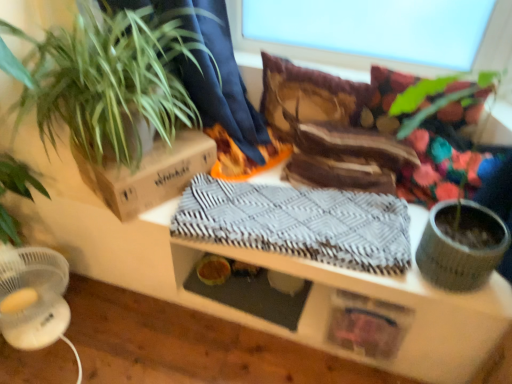
Find the location of `textured wood table at center`. textured wood table at center is located at coordinates (284, 272).

Image resolution: width=512 pixels, height=384 pixels. What do you see at coordinates (298, 223) in the screenshot?
I see `gray woven blanket at center` at bounding box center [298, 223].

The image size is (512, 384). What do you see at coordinates (149, 174) in the screenshot? I see `brown cardboard box at upper left` at bounding box center [149, 174].

Locate an element on the screen. green leafy plant at left is located at coordinates (108, 78).

This screenshot has width=512, height=384. What are the coordinates of `transparent glass window screen at upper center` in the screenshot? It's located at (365, 32).

Looking at this image, from a real-world perspective, is brown cardboard box at upper left physically located above or below textured wood table at center?

From a real-world perspective, brown cardboard box at upper left is physically above textured wood table at center.

Is brown cardboard box at upper left taller than textured wood table at center?

Yes.

Considering the sizes of objects brown cardboard box at upper left and textured wood table at center in the image provided, who is thinner, brown cardboard box at upper left or textured wood table at center?

With smaller width is brown cardboard box at upper left.

Is the position of brown cardboard box at upper left less distant than that of textured wood table at center?

No, it is not.

Does point (300, 235) appear closer or farther from the camera than point (150, 202)?

Point (300, 235) appears to be closer to the viewer than point (150, 202).

Considering the sizes of objects gray woven blanket at center and brown cardboard box at upper left in the image provided, who is bigger, gray woven blanket at center or brown cardboard box at upper left?

gray woven blanket at center.

From the image's perspective, which one is positioned higher, gray woven blanket at center or brown cardboard box at upper left?

From the image's view, brown cardboard box at upper left is above.

Considering the positions of objects gray woven blanket at center and brown cardboard box at upper left in the image provided, who is behind, gray woven blanket at center or brown cardboard box at upper left?

brown cardboard box at upper left is further away from the camera.

Which is more to the left, gray woven blanket at center or transparent glass window screen at upper center?

gray woven blanket at center is more to the left.

From the picture: Considering their positions, is gray woven blanket at center located in front of or behind transparent glass window screen at upper center?

In the image, gray woven blanket at center appears in front of transparent glass window screen at upper center.

Looking at their sizes, would you say gray woven blanket at center is wider or thinner than transparent glass window screen at upper center?

Considering their sizes, gray woven blanket at center looks broader than transparent glass window screen at upper center.

In order to click on table lying above the gray woven blanket at center (from the image's perspective) in this screenshot , I will do `click(284, 272)`.

Is gray woven blanket at center completely or partially inside textured wood table at center?

Yes, gray woven blanket at center can be found within textured wood table at center.

Which object is further away from the camera taking this photo, textured wood table at center or gray woven blanket at center?

gray woven blanket at center is further from the camera.

From a real-world perspective, which is physically above, textured wood table at center or gray woven blanket at center?

From a 3D spatial view, gray woven blanket at center is above.

Which of these two, green leafy plant at left or brown cardboard box at upper left, stands shorter?

Standing shorter between the two is brown cardboard box at upper left.

Which object is wider, green leafy plant at left or brown cardboard box at upper left?

→ Wider between the two is green leafy plant at left.

Is green leafy plant at left to the left of brown cardboard box at upper left from the viewer's perspective?

Yes.

Considering the positions of points (263, 3) and (129, 178), is point (263, 3) farther from camera compared to point (129, 178)?

Yes, point (263, 3) is farther from viewer.

Is transparent glass window screen at upper center spatially inside brown cardboard box at upper left, or outside of it?

transparent glass window screen at upper center is not inside brown cardboard box at upper left, it's outside.

You are a GUI agent. You are given a task and a screenshot of the screen. Output one action in this format:
    pyautogui.click(x=<x>, y=<y>)
    Task: Click on the cardboard box directly beneath the transparent glass window screen at upper center (from a real-world perspective)
    Image resolution: width=512 pixels, height=384 pixels.
    Given the screenshot: What is the action you would take?
    pyautogui.click(x=149, y=174)

Is the surface of transparent glass window screen at upper center in direct contact with brown cardboard box at upper left?

No.

Can you confirm if green leafy plant at left is thinner than velvet brown pillow at center?

No.

From the image's perspective, is green leafy plant at left on velvet brown pillow at center?

Incorrect, from the image's perspective, green leafy plant at left is lower than velvet brown pillow at center.

Can you confirm if green leafy plant at left is shorter than velvet brown pillow at center?

Incorrect, the height of green leafy plant at left does not fall short of that of velvet brown pillow at center.

Where is `pillow above the green leafy plant at left (from the image's perspective)`? Image resolution: width=512 pixels, height=384 pixels. pillow above the green leafy plant at left (from the image's perspective) is located at coordinates (308, 96).

Identify the location of cardboard box that appears above the textured wood table at center (from a real-world perspective). Image resolution: width=512 pixels, height=384 pixels. click(x=149, y=174).

Locate an element on the screen. cardboard box above the gray woven blanket at center (from the image's perspective) is located at coordinates (149, 174).

Looking at the image, which one is located further to brown cardboard box at upper left, transparent glass window screen at upper center or green leafy plant at left?

transparent glass window screen at upper center lies further to brown cardboard box at upper left than the other object.

Looking at the image, which one is located further to brown cardboard box at upper left, velvet brown pillow at center or green leafy plant at left?

Based on the image, velvet brown pillow at center appears to be further to brown cardboard box at upper left.

Based on their spatial positions, is brown cardboard box at upper left or transparent glass window screen at upper center further from green leafy plant at left?

transparent glass window screen at upper center.

Based on their spatial positions, is green leafy plant at left or textured wood table at center closer to transparent glass window screen at upper center?

green leafy plant at left is closer to transparent glass window screen at upper center.

Which object lies further to the anchor point velvet brown pillow at center, textured wood table at center or green leafy plant at left?

Among the two, textured wood table at center is located further to velvet brown pillow at center.

Looking at this image, estimate the real-world distances between objects in this image. Which object is closer to green leafy plant at left, transparent glass window screen at upper center or gray woven blanket at center?

gray woven blanket at center is positioned closer to the anchor green leafy plant at left.

When comparing their distances from transparent glass window screen at upper center, does textured wood table at center or green leafy plant at left seem further?

Among the two, textured wood table at center is located further to transparent glass window screen at upper center.

From the image, which object appears to be farther from transparent glass window screen at upper center, velvet brown pillow at center or brown cardboard box at upper left?

The object further to transparent glass window screen at upper center is brown cardboard box at upper left.

You are a GUI agent. You are given a task and a screenshot of the screen. Output one action in this format:
    pyautogui.click(x=<x>, y=<y>)
    Task: Click on the blanket between brown cardboard box at upper left and transparent glass window screen at upper center from left to right
    Image resolution: width=512 pixels, height=384 pixels.
    Given the screenshot: What is the action you would take?
    pyautogui.click(x=298, y=223)

Locate an element on the screen. The width and height of the screenshot is (512, 384). cardboard box between green leafy plant at left and transparent glass window screen at upper center in the horizontal direction is located at coordinates (149, 174).

This screenshot has width=512, height=384. I want to click on pillow between green leafy plant at left and transparent glass window screen at upper center from left to right, so click(x=308, y=96).

Identify the location of table between brown cardboard box at upper left and transparent glass window screen at upper center from left to right. This screenshot has height=384, width=512. (284, 272).